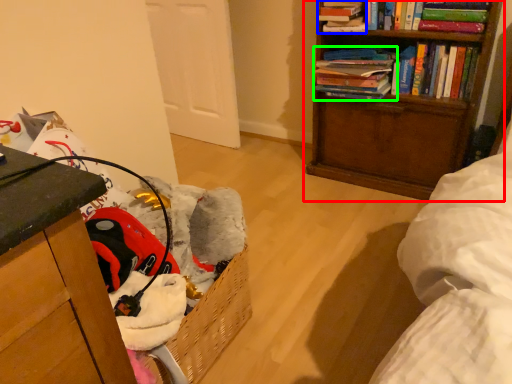
Question: Which object is positioned closest to bookcase (highlighted by a red box)? Select from book (highlighted by a blue box) and book (highlighted by a green box).

Choices:
 (A) book
 (B) book

Answer: (B)